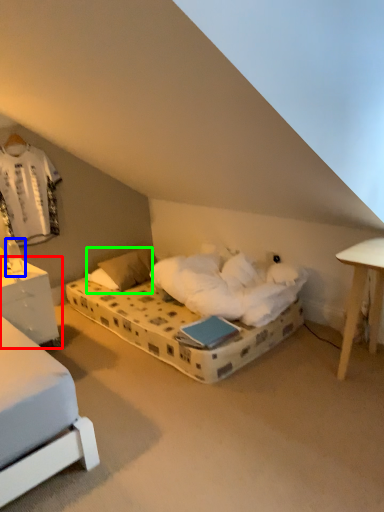
Question: Which is nearer to the nightstand (highlighted by a red box)? table lamp (highlighted by a blue box) or pillow (highlighted by a green box).

Choices:
 (A) table lamp
 (B) pillow

Answer: (A)